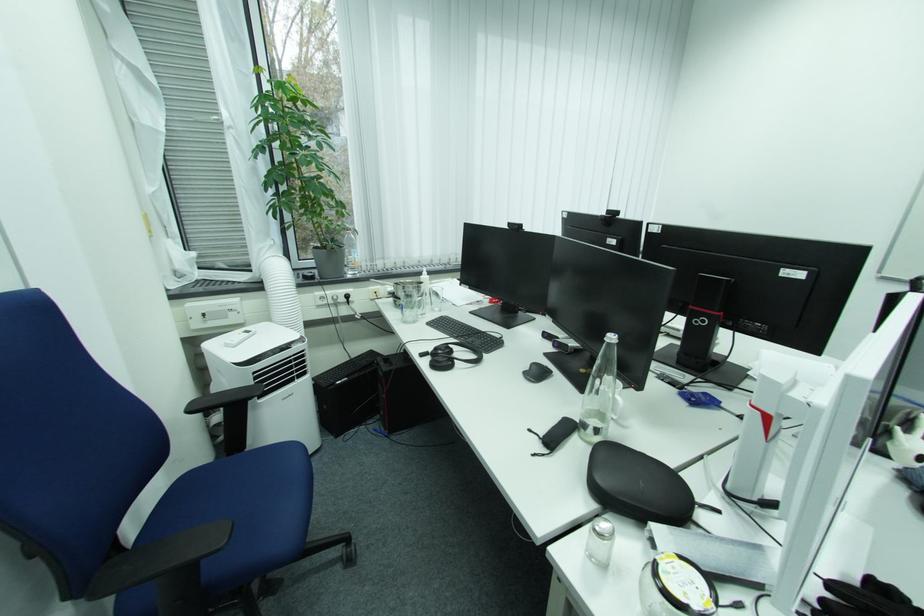
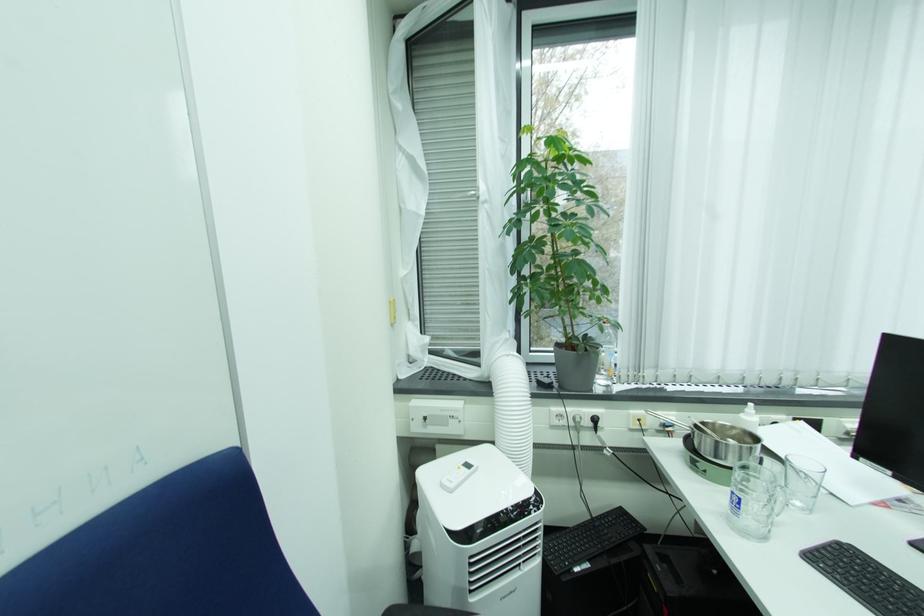
Question: How did the camera likely rotate?

Choices:
 (A) Left
 (B) Right
 (C) Up
 (D) Down

Answer: (A)